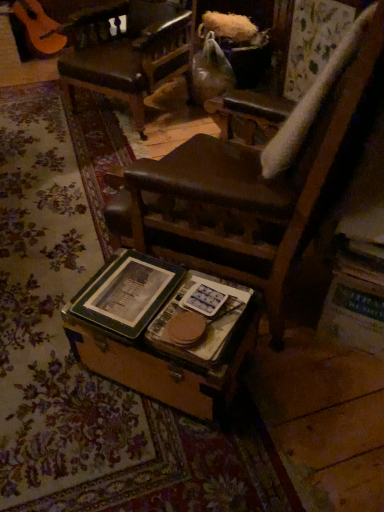
Question: From a real-world perspective, is green matte book at center, acting as the 1th paperback book starting from the left, above or below leather seat at center?

Choices:
 (A) below
 (B) above

Answer: (A)

Question: In terms of size, does green matte book at center, acting as the 1th paperback book starting from the left, appear bigger or smaller than leather seat at center?

Choices:
 (A) small
 (B) big

Answer: (A)

Question: Estimate the real-world distances between objects in this image. Which object is farther from the wooden trunk at center?

Choices:
 (A) green matte book at center, acting as the 1th paperback book starting from the left
 (B) leather seat at center
 (C) hardcover book at center, marked as the 2th paperback book in a left-to-right arrangement

Answer: (B)

Question: Which is nearer to the hardcover book at center, marked as the 2th paperback book in a left-to-right arrangement?

Choices:
 (A) leather seat at center
 (B) wooden trunk at center
 (C) green matte book at center, acting as the 1th paperback book starting from the left

Answer: (B)